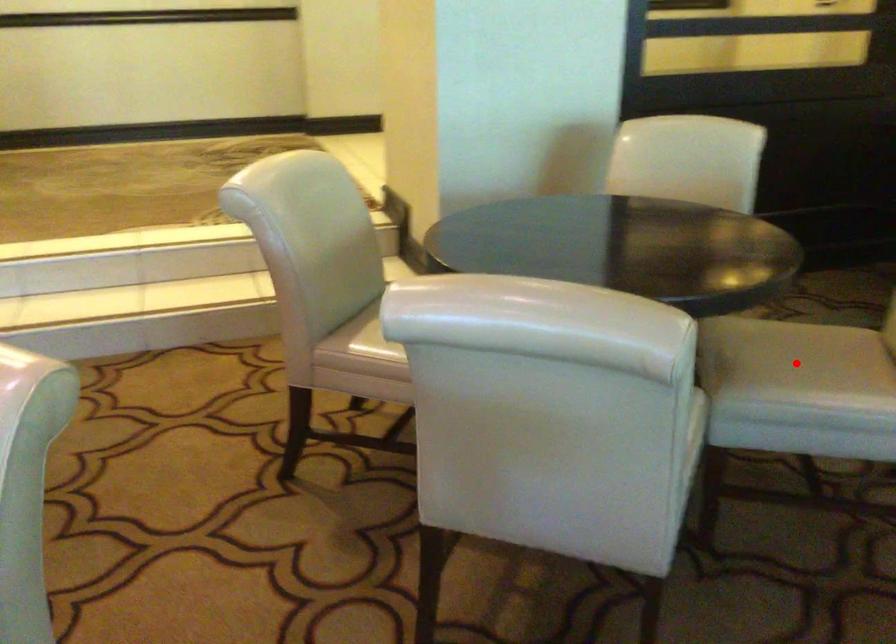
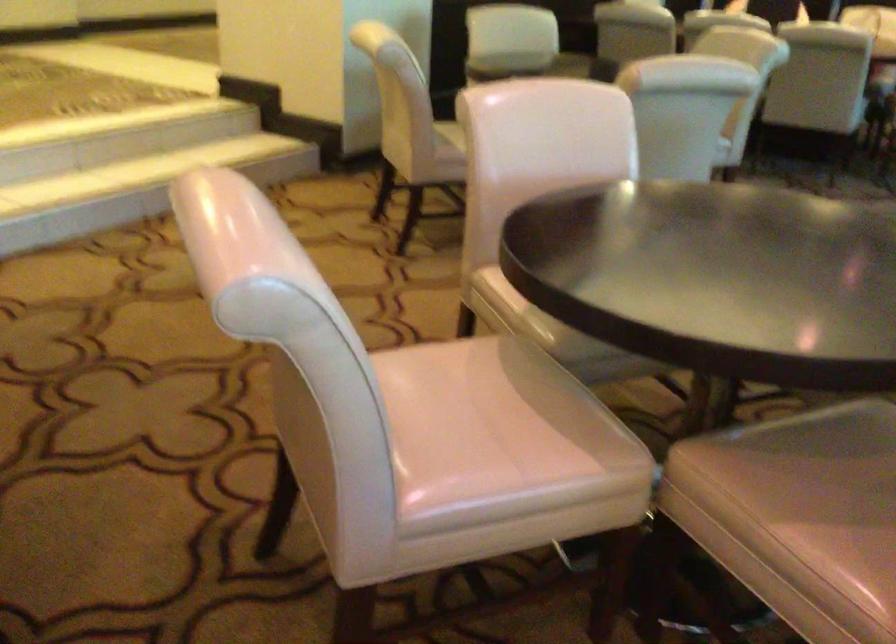
Question: I am providing you with two images of the same scene from different viewpoints. A red point is marked on the first image. Can you still see the location of the red point in image 2?

Choices:
 (A) Yes
 (B) No

Answer: (B)